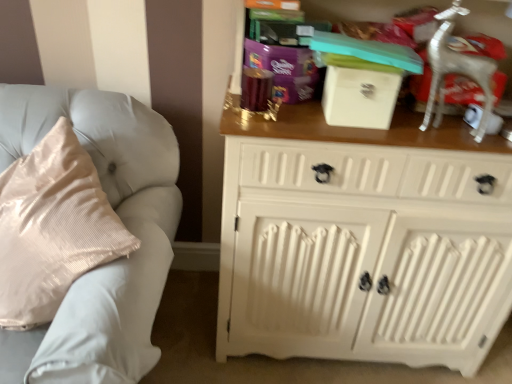
At what (x,y) coordinates should I click in order to perform the action: click on empty space that is ontop of purple glossy gift at upper center (from a real-world perspective). Please return your answer as a coordinate pair (x, y). This screenshot has height=384, width=512. Looking at the image, I should click on (x=274, y=39).